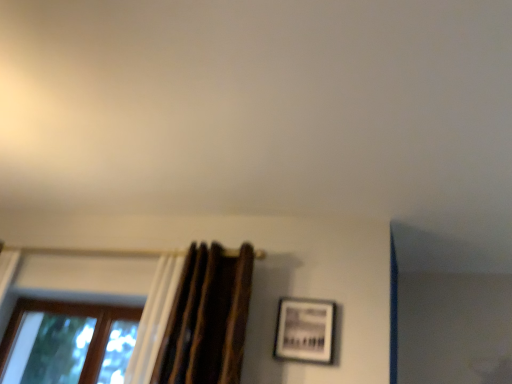
Describe the element at coordinates (197, 319) in the screenshot. I see `brown textured curtain at left` at that location.

What is the approximate width of brown wooden window at lower left?

5.49 inches.

Image resolution: width=512 pixels, height=384 pixels. Find the location of `matte black picture frame at center-right`. matte black picture frame at center-right is located at coordinates (305, 330).

Locate an element on the screen. The image size is (512, 384). curtain in front of the brown wooden window at lower left is located at coordinates (197, 319).

Is brown textured curtain at left placed right next to brown wooden window at lower left?

No, brown textured curtain at left is not with brown wooden window at lower left.

Based on the photo, is brown textured curtain at left at the left side of brown wooden window at lower left?

No.

Is brown wooden window at lower left not within matte black picture frame at center-right?

Absolutely, brown wooden window at lower left is external to matte black picture frame at center-right.

From the image's perspective, is brown wooden window at lower left on top of matte black picture frame at center-right?

Actually, brown wooden window at lower left appears below matte black picture frame at center-right in the image.

Considering the relative sizes of brown wooden window at lower left and matte black picture frame at center-right in the image provided, is brown wooden window at lower left smaller than matte black picture frame at center-right?

Incorrect, brown wooden window at lower left is not smaller in size than matte black picture frame at center-right.

You are a GUI agent. You are given a task and a screenshot of the screen. Output one action in this format:
    pyautogui.click(x=<x>, y=<y>)
    Task: Click on the picture frame on the right of the brown wooden window at lower left
    Image resolution: width=512 pixels, height=384 pixels.
    Given the screenshot: What is the action you would take?
    pyautogui.click(x=305, y=330)

Are matte black picture frame at center-right and brown wooden window at lower left far apart?

Yes.

Locate an element on the screen. This screenshot has height=384, width=512. window that is under the matte black picture frame at center-right (from a real-world perspective) is located at coordinates (64, 341).

From a real-world perspective, is matte black picture frame at center-right positioned under brown wooden window at lower left based on gravity?

No, from a real-world perspective, matte black picture frame at center-right is not under brown wooden window at lower left.

Which point is more forward, (x=302, y=341) or (x=102, y=355)?

The point (x=302, y=341) is closer.

I want to click on curtain that appears in front of the brown wooden window at lower left, so click(197, 319).

Could you tell me if brown wooden window at lower left is facing brown textured curtain at left?

No.

From a real-world perspective, which object rests below the other?

brown wooden window at lower left, from a real-world perspective.

This screenshot has width=512, height=384. I want to click on picture frame that is above the brown textured curtain at left (from a real-world perspective), so click(x=305, y=330).

Is matte black picture frame at center-right positioned far away from brown textured curtain at left?

matte black picture frame at center-right is near brown textured curtain at left, not far away.

Consider the image. Considering the sizes of objects matte black picture frame at center-right and brown textured curtain at left in the image provided, who is taller, matte black picture frame at center-right or brown textured curtain at left?

brown textured curtain at left.

From the image's perspective, is matte black picture frame at center-right beneath brown textured curtain at left?

Correct, matte black picture frame at center-right appears lower than brown textured curtain at left in the image.

Between brown textured curtain at left and matte black picture frame at center-right, which one has smaller width?

matte black picture frame at center-right.

Considering the sizes of brown textured curtain at left and matte black picture frame at center-right in the image, is brown textured curtain at left taller or shorter than matte black picture frame at center-right?

Considering their sizes, brown textured curtain at left has more height than matte black picture frame at center-right.

From the image's perspective, would you say brown textured curtain at left is shown under matte black picture frame at center-right?

No.

Looking at this image, is brown textured curtain at left positioned far away from matte black picture frame at center-right?

No, brown textured curtain at left is not far away from matte black picture frame at center-right.

The width and height of the screenshot is (512, 384). I want to click on window below the brown textured curtain at left (from the image's perspective), so click(x=64, y=341).

Find the location of `picture frame that is above the brown wooden window at lower left (from a real-world perspective)`. picture frame that is above the brown wooden window at lower left (from a real-world perspective) is located at coordinates (305, 330).

Estimate the real-world distances between objects in this image. Which object is further from brown wooden window at lower left, brown textured curtain at left or matte black picture frame at center-right?

matte black picture frame at center-right lies further to brown wooden window at lower left than the other object.

From the image, which object appears to be farther from brown textured curtain at left, matte black picture frame at center-right or brown wooden window at lower left?

brown wooden window at lower left is positioned further to the anchor brown textured curtain at left.

When comparing their distances from brown wooden window at lower left, does matte black picture frame at center-right or brown textured curtain at left seem further?

matte black picture frame at center-right lies further to brown wooden window at lower left than the other object.

Based on their spatial positions, is brown textured curtain at left or brown wooden window at lower left closer to matte black picture frame at center-right?

Based on the image, brown textured curtain at left appears to be nearer to matte black picture frame at center-right.

Looking at the image, which one is located closer to brown textured curtain at left, brown wooden window at lower left or matte black picture frame at center-right?

Based on the image, matte black picture frame at center-right appears to be nearer to brown textured curtain at left.

When comparing their distances from matte black picture frame at center-right, does brown wooden window at lower left or brown textured curtain at left seem closer?

Among the two, brown textured curtain at left is located nearer to matte black picture frame at center-right.

The width and height of the screenshot is (512, 384). Identify the location of curtain situated between brown wooden window at lower left and matte black picture frame at center-right from left to right. (197, 319).